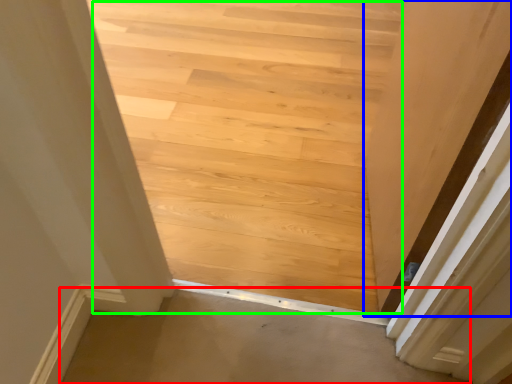
Question: Estimate the real-world distances between objects in this image. Which object is closer to plain (highlighted by a red box), door (highlighted by a blue box) or stairwell (highlighted by a green box)?

Choices:
 (A) door
 (B) stairwell

Answer: (A)